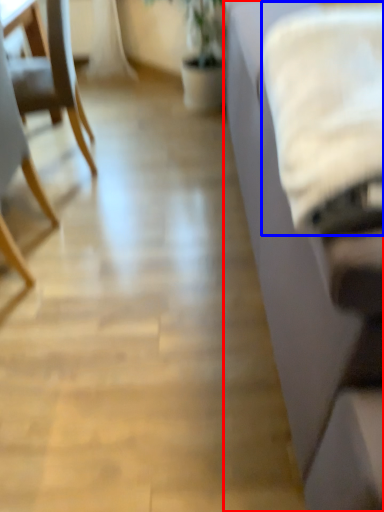
Question: Which object is closer to the camera taking this photo, studio couch (highlighted by a red box) or sheet (highlighted by a blue box)?

Choices:
 (A) studio couch
 (B) sheet

Answer: (A)